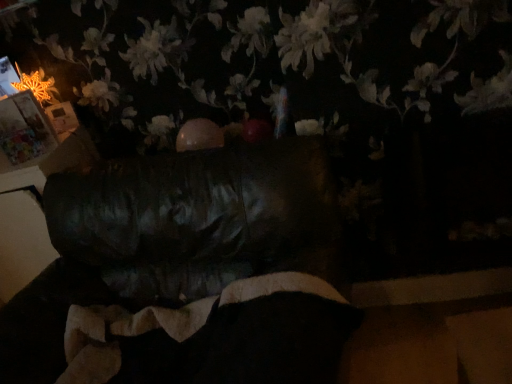
Locate an element on the screen. leather bean bag at center is located at coordinates (193, 266).

What do you see at coordinates (193, 266) in the screenshot? This screenshot has height=384, width=512. I see `leather bean bag at center` at bounding box center [193, 266].

Where is `leather bean bag at center`? This screenshot has width=512, height=384. leather bean bag at center is located at coordinates (193, 266).